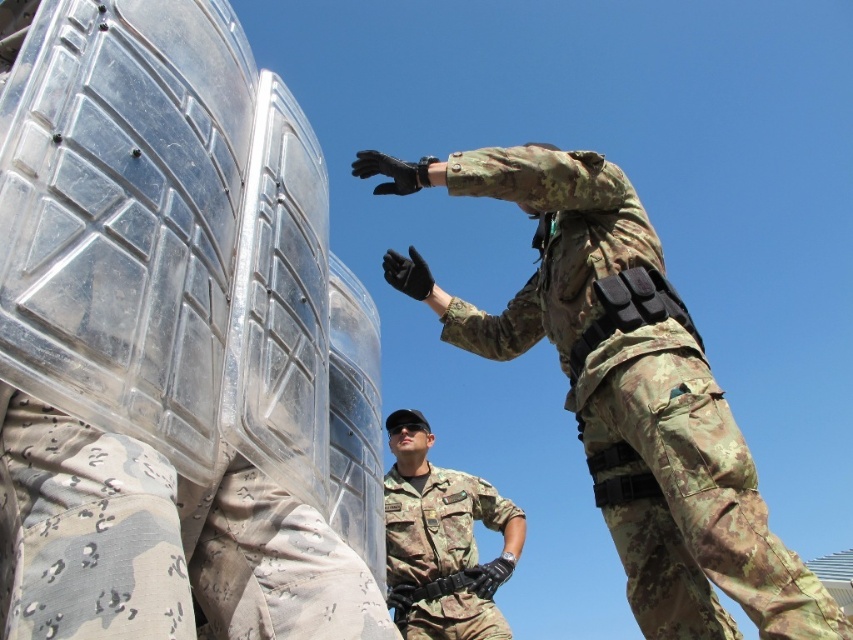
Does camouflage fabric uniform at center have a greater width compared to camouflage uniform at center?

Indeed, camouflage fabric uniform at center has a greater width compared to camouflage uniform at center.

Between camouflage fabric uniform at center and camouflage uniform at center, which one is positioned higher?

camouflage fabric uniform at center is higher up.

The width and height of the screenshot is (853, 640). Describe the element at coordinates (625, 392) in the screenshot. I see `camouflage fabric uniform at center` at that location.

Image resolution: width=853 pixels, height=640 pixels. I want to click on camouflage fabric uniform at center, so click(625, 392).